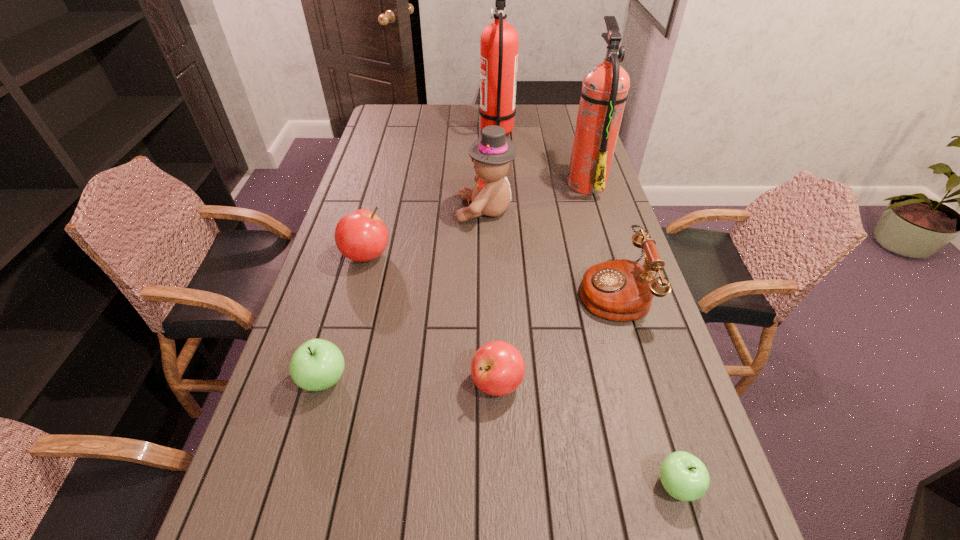
Find the location of a particular element. The image size is (960, 540). vacant space that satisfies the following two spatial constraints: 1. on the front side of the smaller red apple; 2. on the left side of the nearer green apple is located at coordinates (500, 485).

Find the location of `free region that satisfies the following two spatial constraints: 1. on the dial of the telephone; 2. on the front side of the nearer red apple`. free region that satisfies the following two spatial constraints: 1. on the dial of the telephone; 2. on the front side of the nearer red apple is located at coordinates (639, 383).

Identify the location of blank area in the image that satisfies the following two spatial constraints: 1. on the front-facing side of the rag_doll; 2. on the back side of the nearer red apple. (487, 383).